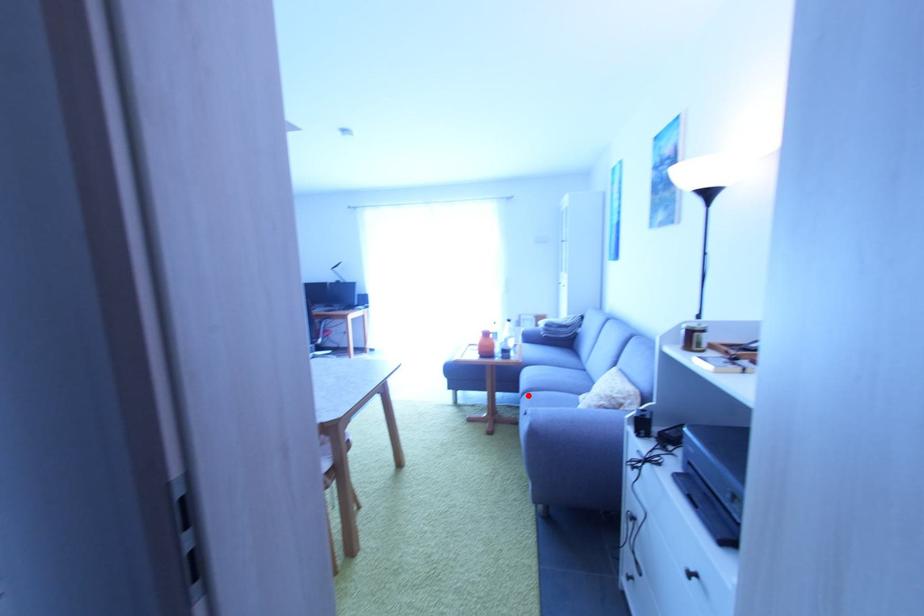
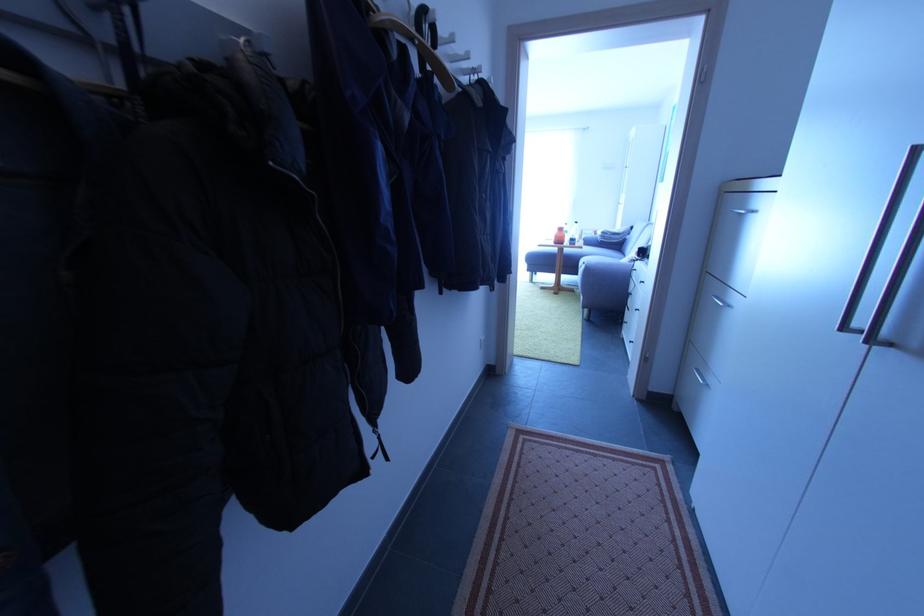
Question: I am providing you with two images of the same scene from different viewpoints. A red point is shown in image1. For the corresponding object point in image2, is it positioned nearer or farther from the camera?

Choices:
 (A) Nearer
 (B) Farther

Answer: (A)